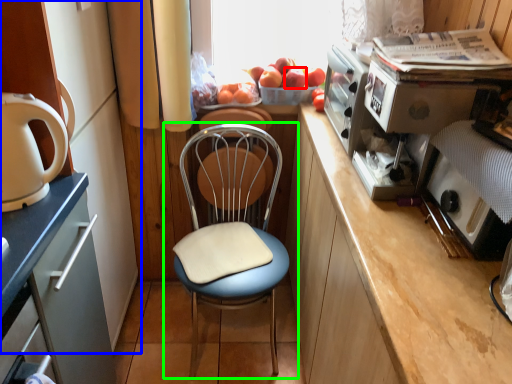
Question: Which object is positioned farthest from apple (highlighted by a red box)? Select from cabinetry (highlighted by a blue box) and chair (highlighted by a green box).

Choices:
 (A) cabinetry
 (B) chair

Answer: (A)